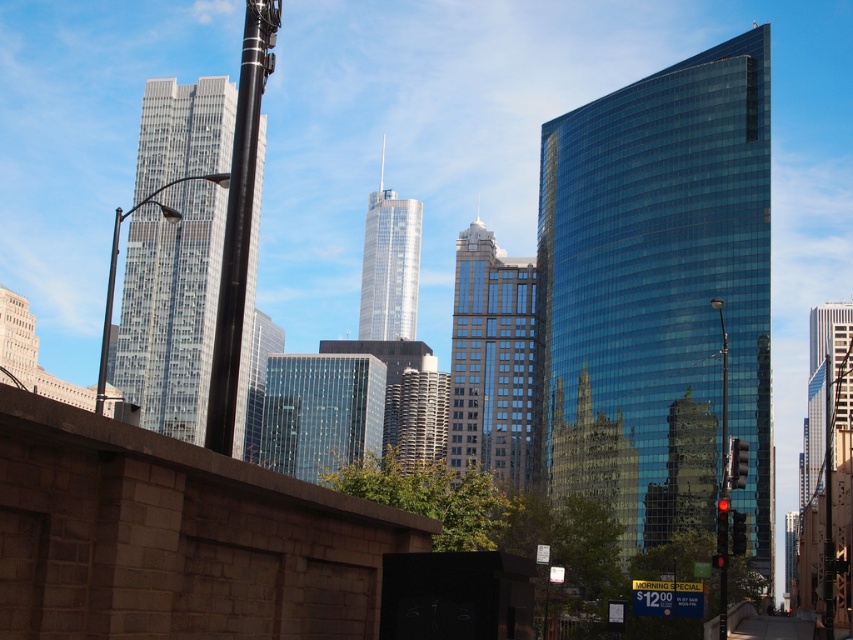
You are standing on the stone wall in the foreground and want to take a photo of the shiny glass skyscraper at center. Your camera can focus on objects up to 400 feet away. Will the skyscraper be in focus?

The shiny glass skyscraper at center is 388.69 feet from viewer, so yes, the camera can focus on it since it is within the 400 feet range.

You are standing in the urban skyline scene and want to determine which of the two points, point (223,260) or point (370,266), is nearer to you. Based on the scene description, which point is closer?

Point (223,260) is closer to the viewer than point (370,266).